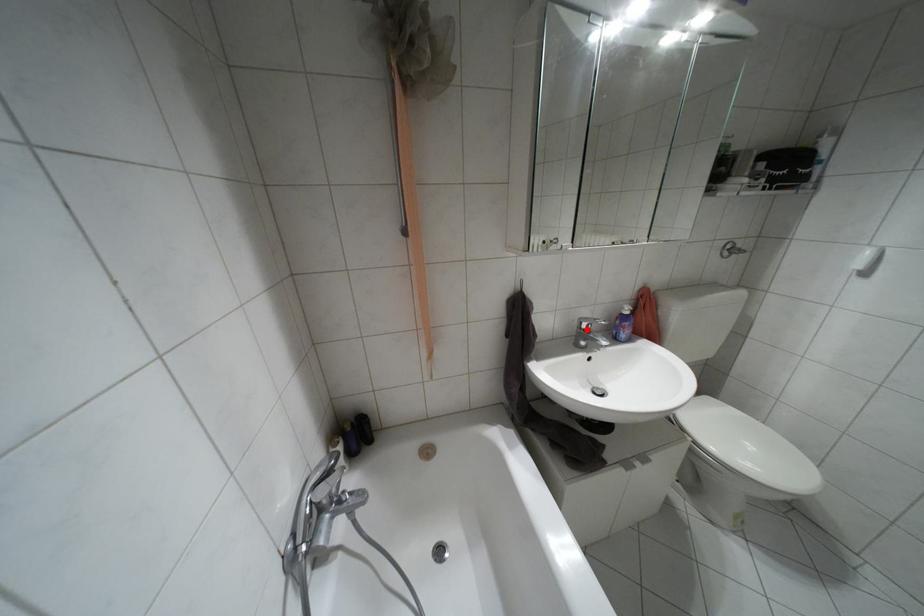
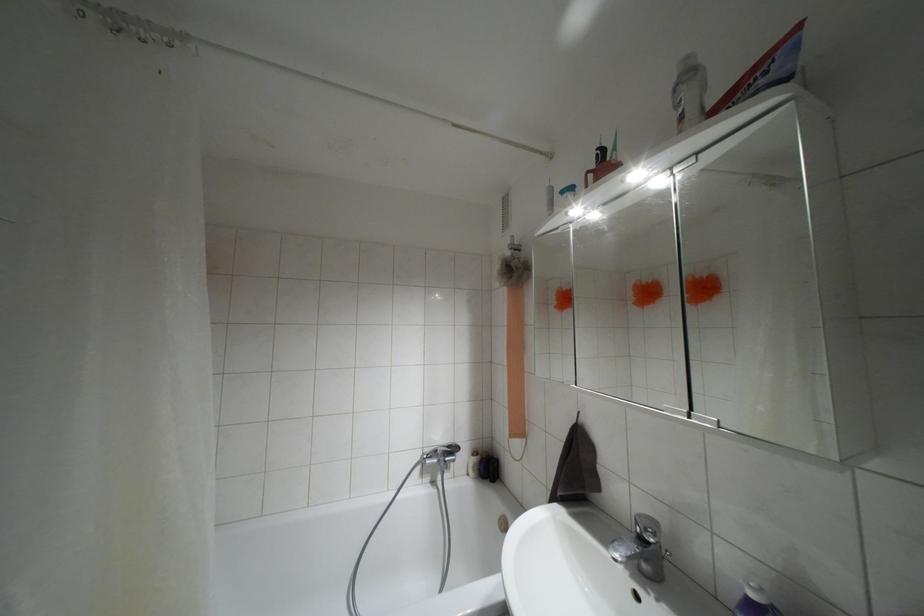
The point at the highlighted location is marked in the first image. Where is the corresponding point in the second image?

(641, 538)